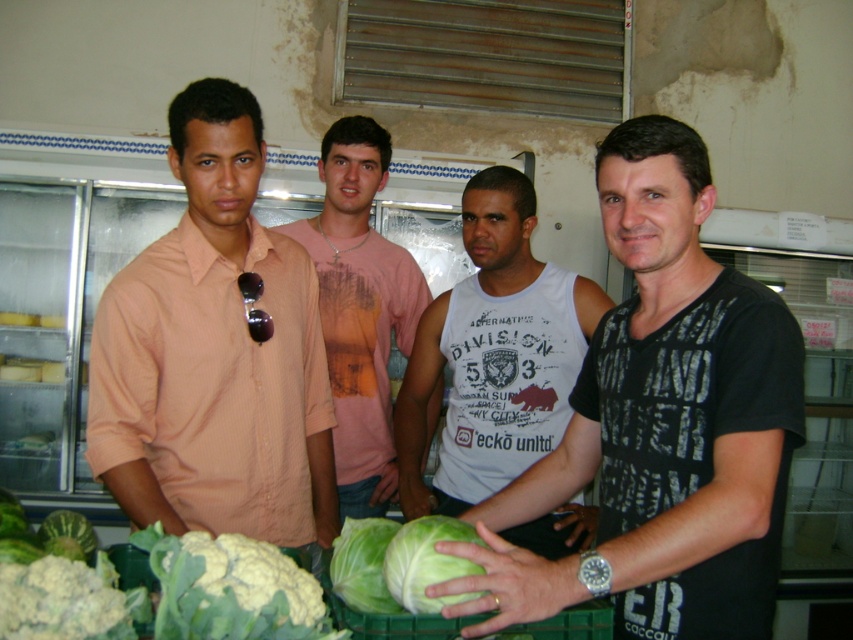
In the image, there are four people standing in a market setting with refrigerated display units in the background. You notice a point labeled as point (427,563). What object is located at that point?

The point (427,563) marks the green matte cabbage at center.

You are a food vendor at the market and need to place both the white fluffy cauliflower at lower left and the green matte cabbage at lower left on a shelf. The shelf has a maximum width of 1 meter. If the cabbage is 30 cm wide, can both items fit side by side?

The white fluffy cauliflower at lower left is wider than the green matte cabbage at lower left. Since the cabbage is 30 cm wide and the cauliflower is wider, their combined width would exceed the 1 meter shelf. Therefore, both items cannot fit side by side on the shelf.